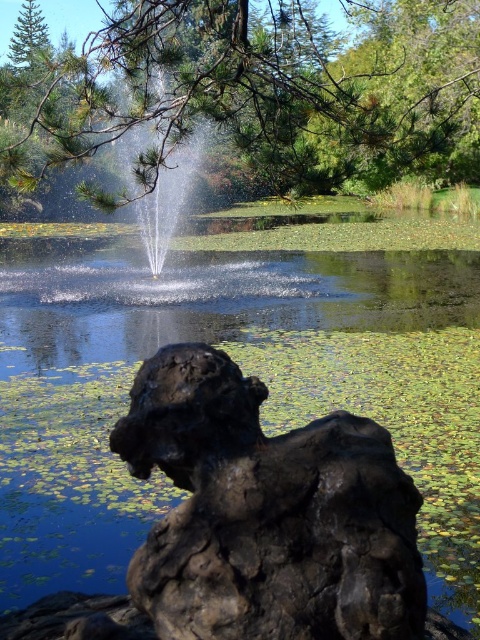
Question: Can you confirm if green lily pads at center is positioned above green matte tree branches at upper center?

Choices:
 (A) no
 (B) yes

Answer: (A)

Question: Among these objects, which one is farthest from the camera?

Choices:
 (A) green matte tree branches at upper center
 (B) green lily pads at center

Answer: (A)

Question: Which object appears farthest from the camera in this image?

Choices:
 (A) green lily pads at center
 (B) rustic stone statue at center

Answer: (A)

Question: Is green matte tree branches at upper center below rustic stone statue at center?

Choices:
 (A) yes
 (B) no

Answer: (B)

Question: Which object is positioned farthest from the green lily pads at center?

Choices:
 (A) green matte tree branches at upper center
 (B) rustic stone statue at center

Answer: (A)

Question: Is green lily pads at center above rustic stone statue at center?

Choices:
 (A) yes
 (B) no

Answer: (A)